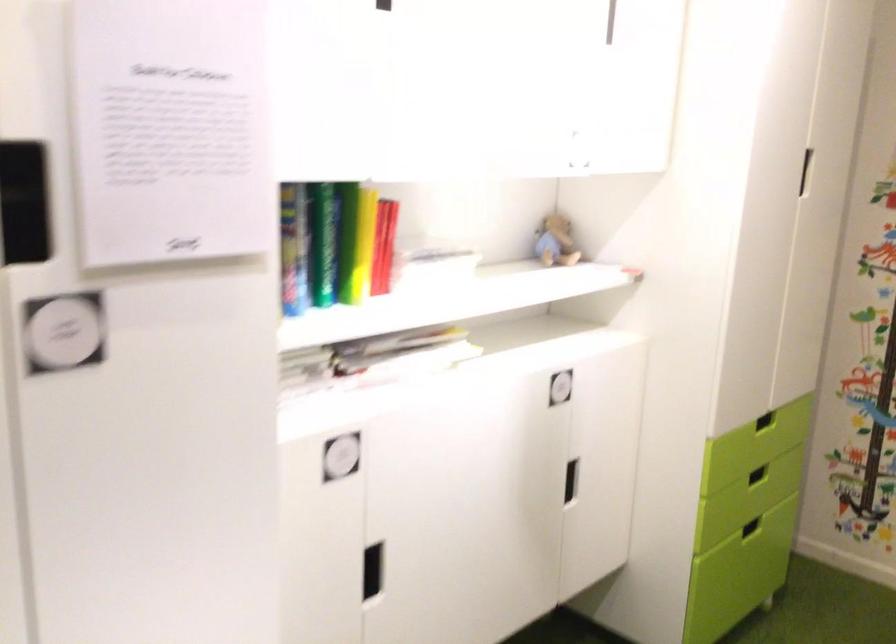
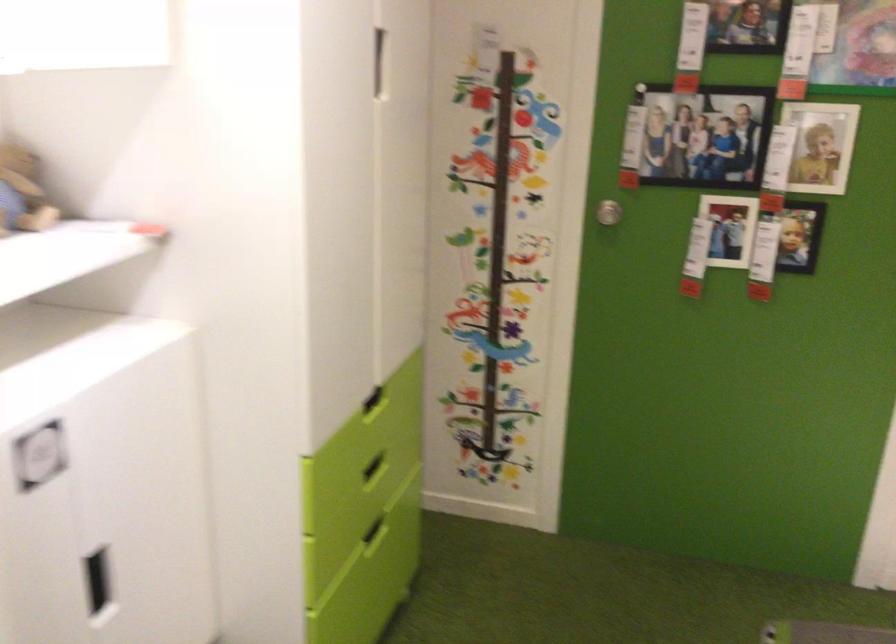
Question: The first image is from the beginning of the video and the second image is from the end. How did the camera likely rotate when shooting the video?

Choices:
 (A) Left
 (B) Right
 (C) Up
 (D) Down

Answer: (B)